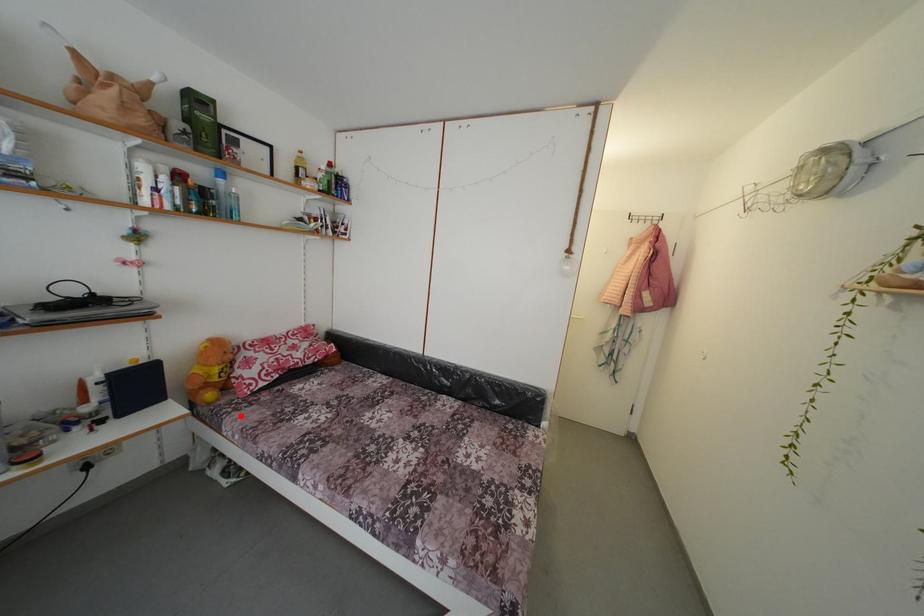
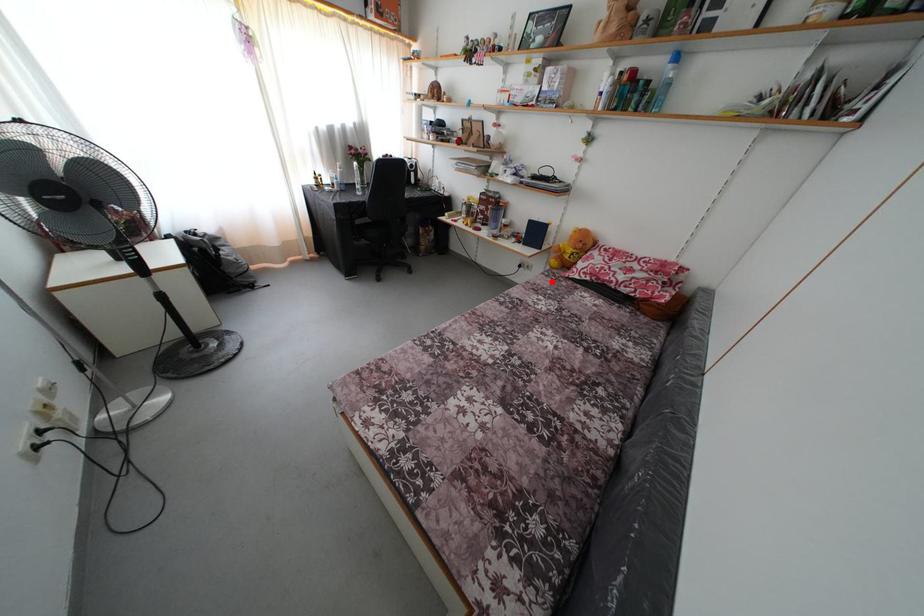
I am providing you with two images of the same scene from different viewpoints. A red point is marked on the first image and another point is marked on the second image. Is the marked point in image1 the same physical position as the marked point in image2?

Yes